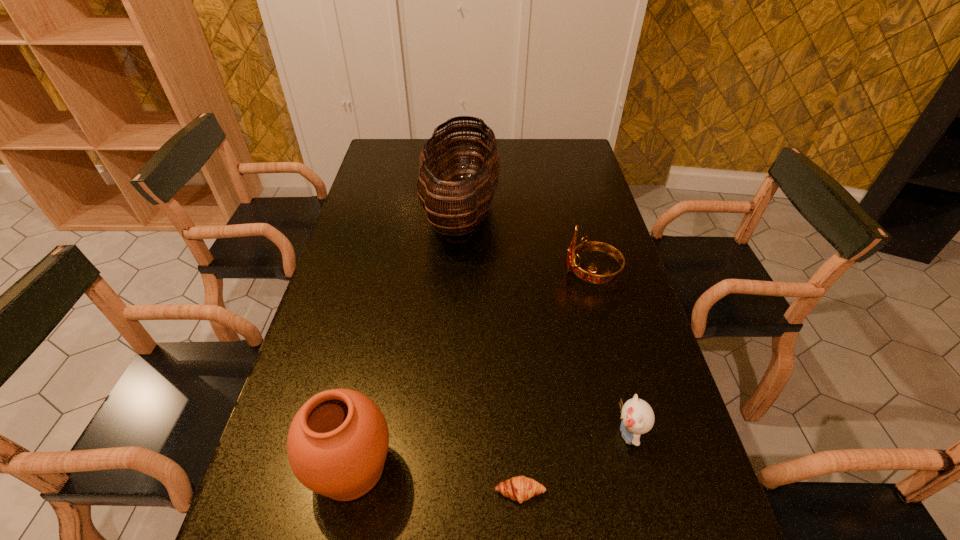
I want to click on free location located on the front-facing side of the kitten, so click(x=422, y=434).

At what (x,y) coordinates should I click in order to perform the action: click on free point located on the front-facing side of the kitten. Please return your answer as a coordinate pair (x, y). Looking at the image, I should click on (432, 434).

Locate an element on the screen. This screenshot has height=540, width=960. vacant area situated on the front-facing side of the kitten is located at coordinates (537, 434).

The image size is (960, 540). In order to click on object at the left edge in this screenshot , I will do `click(337, 444)`.

I want to click on tiara located at the right edge, so click(x=573, y=251).

You are a GUI agent. You are given a task and a screenshot of the screen. Output one action in this format:
    pyautogui.click(x=<x>, y=<y>)
    Task: Click on the kitten that is at the right edge
    
    Given the screenshot: What is the action you would take?
    pyautogui.click(x=637, y=416)

This screenshot has width=960, height=540. I want to click on vacant area at the far edge of the desktop, so click(x=518, y=167).

I want to click on vacant space at the left edge, so click(x=379, y=186).

Image resolution: width=960 pixels, height=540 pixels. Identify the location of free space at the right edge. (632, 343).

Where is `vacant space at the far left corner of the desktop`? The height and width of the screenshot is (540, 960). vacant space at the far left corner of the desktop is located at coordinates (389, 143).